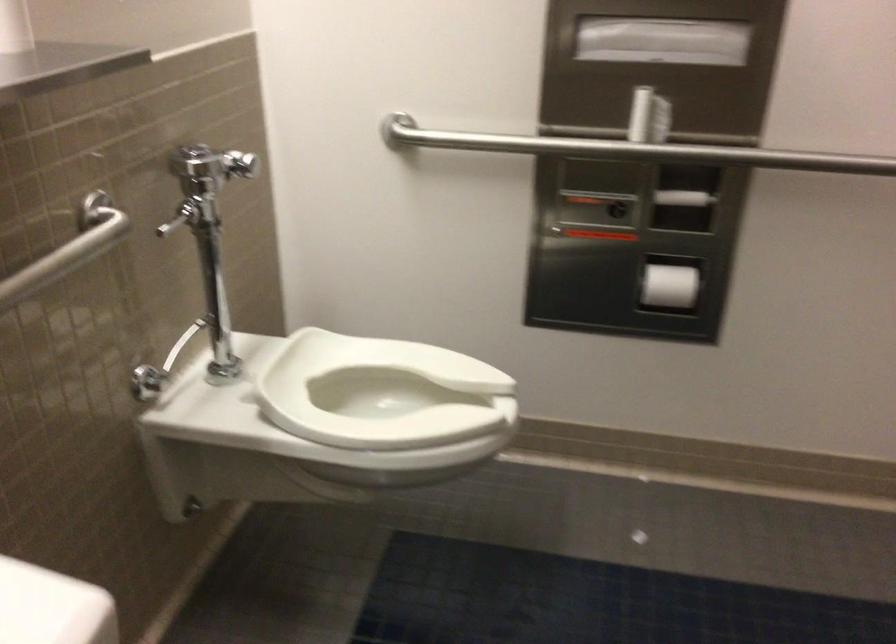
The width and height of the screenshot is (896, 644). Find the location of `chrome flush handle`. chrome flush handle is located at coordinates (203, 180).